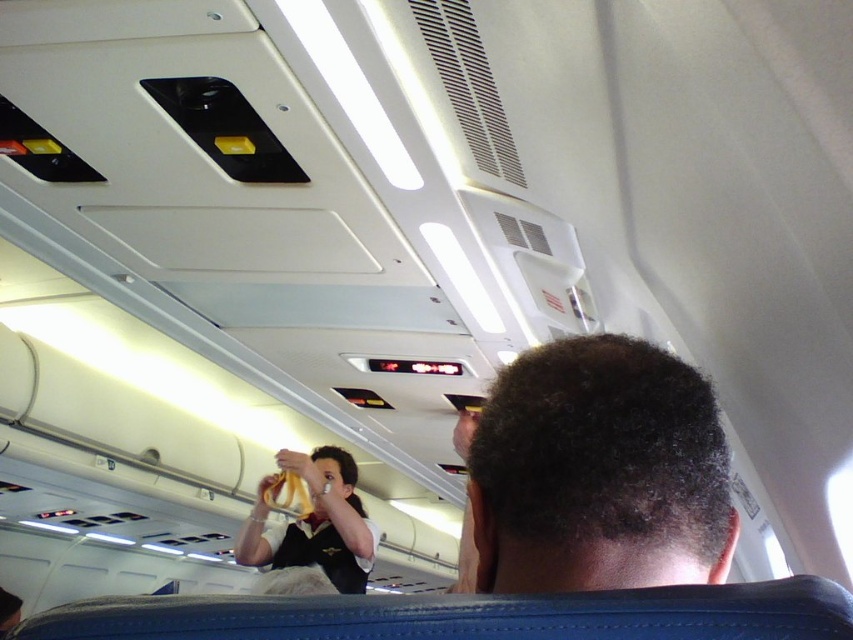
Which is more to the left, dark curly hair at center or white uniform at center?

From the viewer's perspective, white uniform at center appears more on the left side.

Who is more distant from viewer, (511,545) or (323,488)?

The point (323,488) is more distant.

Is point (543, 384) positioned after point (258, 532)?

No.

The image size is (853, 640). I want to click on dark curly hair at center, so click(596, 472).